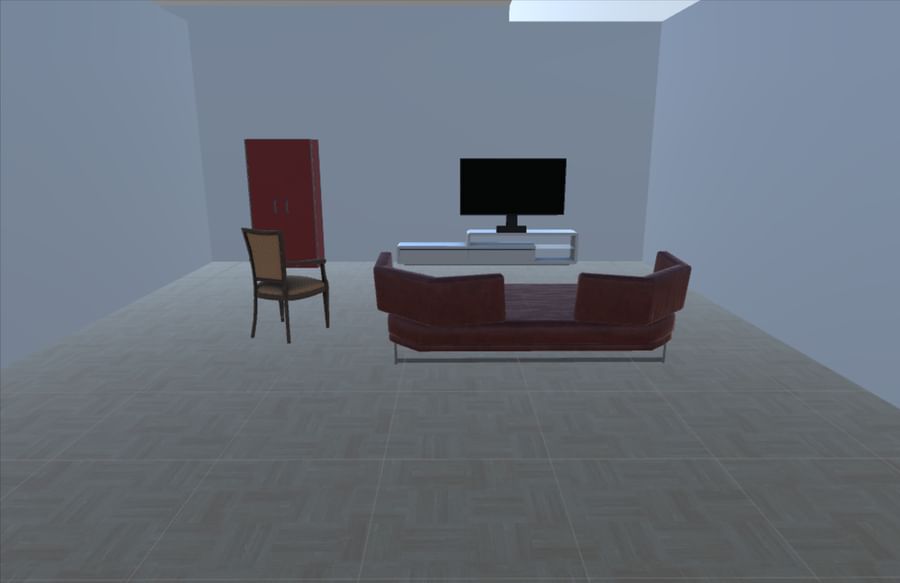
What are the coordinates of `chair legs` in the screenshot? It's located at (284, 326), (254, 328), (326, 314), (282, 312).